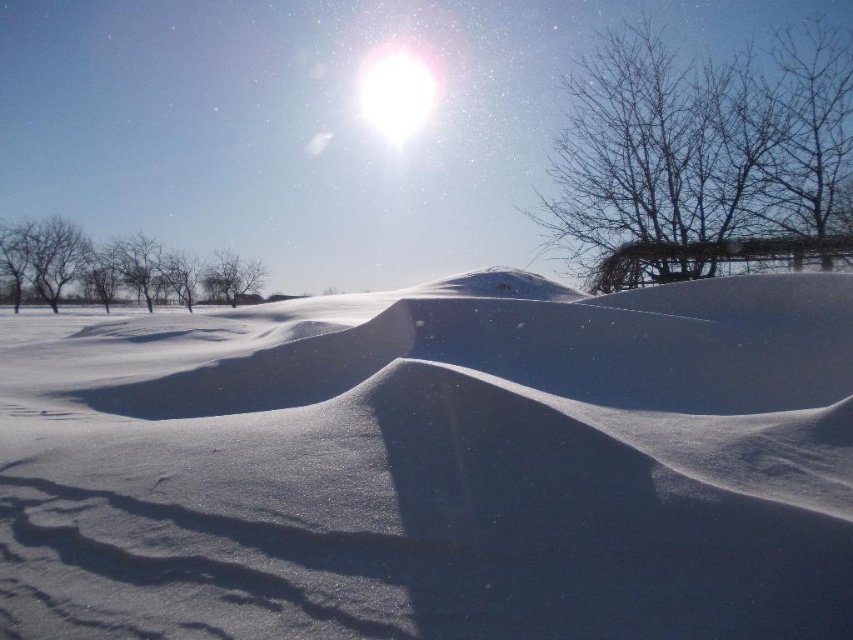
Question: Is the position of bare branches at upper right less distant than that of bare branches at left?

Choices:
 (A) yes
 (B) no

Answer: (A)

Question: Does bare branches at left appear over bare branches at center?

Choices:
 (A) yes
 (B) no

Answer: (A)

Question: Which point is farther from the camera taking this photo?

Choices:
 (A) (253, 262)
 (B) (836, 122)
 (C) (259, 266)

Answer: (C)

Question: Which point appears farthest from the camera in this image?

Choices:
 (A) (714, 230)
 (B) (228, 300)
 (C) (212, 260)

Answer: (B)

Question: Which of the following is the closest to the observer?

Choices:
 (A) (218, 285)
 (B) (827, 195)

Answer: (B)

Question: In this image, where is bare branches at left located relative to bare branches at center?

Choices:
 (A) left
 (B) right

Answer: (A)